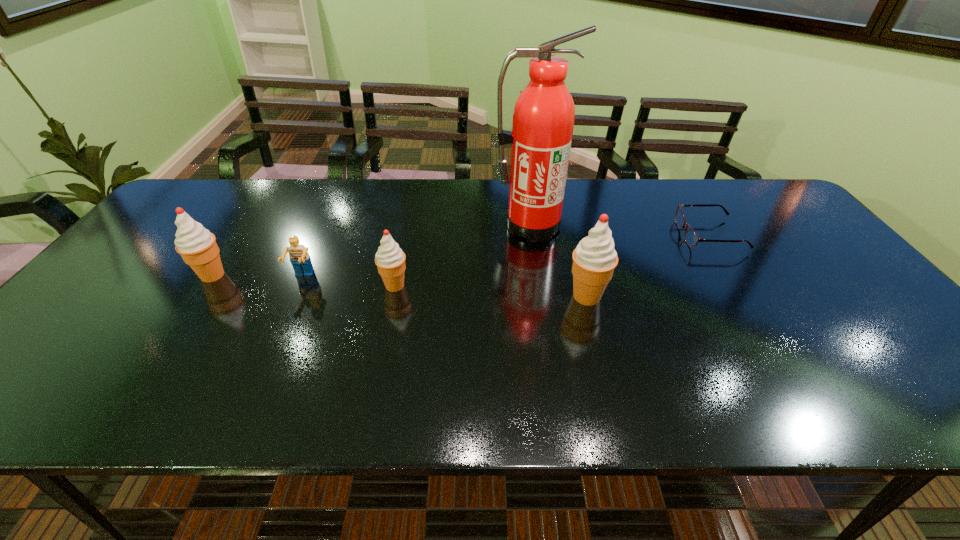
Where is `vacant space located on the back of the second tallest icecream`? vacant space located on the back of the second tallest icecream is located at coordinates (257, 209).

You are a GUI agent. You are given a task and a screenshot of the screen. Output one action in this format:
    pyautogui.click(x=<x>, y=<y>)
    Task: Click on the free location located on the right of the fourth tallest object
    
    Given the screenshot: What is the action you would take?
    pyautogui.click(x=464, y=286)

Identify the location of vacant space situated on the right of the rightmost icecream. The image size is (960, 540). (756, 296).

Image resolution: width=960 pixels, height=540 pixels. Find the location of `vacant space located on the label side of the tallest object`. vacant space located on the label side of the tallest object is located at coordinates (538, 277).

I want to click on free location located on the lenses of the shortest object, so click(586, 235).

Locate an element on the screen. Image resolution: width=960 pixels, height=540 pixels. free space located on the lenses of the shortest object is located at coordinates (564, 235).

You are a GUI agent. You are given a task and a screenshot of the screen. Output one action in this format:
    pyautogui.click(x=<x>, y=<y>)
    Task: Click on the vacant space located 0.080m on the lenses of the shortest object
    
    Given the screenshot: What is the action you would take?
    pyautogui.click(x=654, y=235)

You are a GUI agent. You are given a task and a screenshot of the screen. Output one action in this format:
    pyautogui.click(x=<x>, y=<y>)
    Task: Click on the free region located 0.050m on the face of the second shortest object
    The image size is (960, 540).
    Given the screenshot: What is the action you would take?
    pyautogui.click(x=293, y=299)

This screenshot has width=960, height=540. Identify the location of fire extinguisher at the far edge. (543, 120).

Image resolution: width=960 pixels, height=540 pixels. In order to click on spectacles that is at the far edge in this screenshot , I will do `click(691, 238)`.